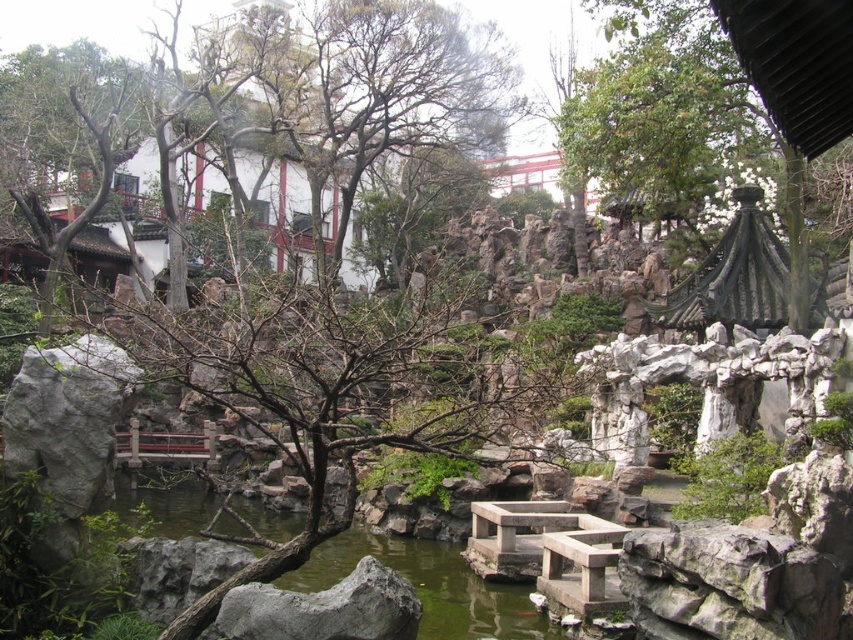
Question: Can you confirm if green leafy tree at upper center is positioned to the left of green stone water at center?

Choices:
 (A) yes
 (B) no

Answer: (B)

Question: Can you confirm if green leafy tree at upper center is wider than green stone water at center?

Choices:
 (A) yes
 (B) no

Answer: (B)

Question: Among these points, which one is farthest from the camera?

Choices:
 (A) (660, 140)
 (B) (119, 493)

Answer: (A)

Question: Which point is farther from the camera taking this photo?

Choices:
 (A) (167, 620)
 (B) (656, 161)

Answer: (B)

Question: Is green leafy tree at upper center thinner than green stone water at center?

Choices:
 (A) no
 (B) yes

Answer: (B)